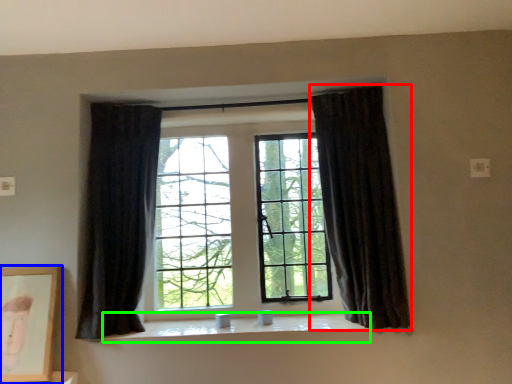
Question: Which object is the farthest from curtain (highlighted by a red box)? Choose among these: picture frame (highlighted by a blue box) or window sill (highlighted by a green box).

Choices:
 (A) picture frame
 (B) window sill

Answer: (A)